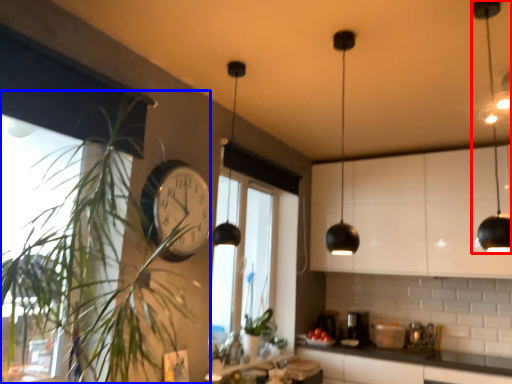
Question: Which point is further to the camera, light fixture (highlighted by a red box) or houseplant (highlighted by a blue box)?

Choices:
 (A) light fixture
 (B) houseplant

Answer: (A)